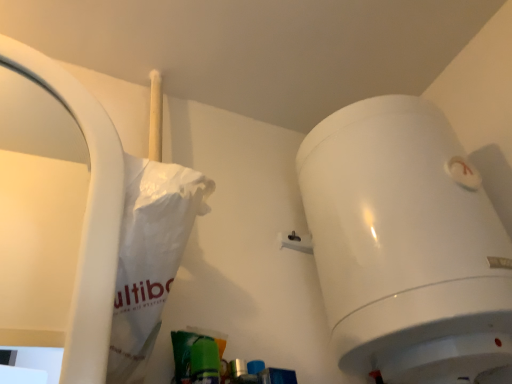
Question: Considering the positions of white glossy toilet at upper right and white paper bag at left in the image, is white glossy toilet at upper right wider or thinner than white paper bag at left?

Choices:
 (A) thin
 (B) wide

Answer: (B)

Question: Which is correct: white glossy toilet at upper right is inside white paper bag at left, or outside of it?

Choices:
 (A) outside
 (B) inside

Answer: (A)

Question: Considering their positions, is white glossy toilet at upper right located in front of or behind white paper bag at left?

Choices:
 (A) front
 (B) behind

Answer: (B)

Question: Does point (129, 314) appear closer or farther from the camera than point (442, 269)?

Choices:
 (A) farther
 (B) closer

Answer: (B)

Question: From the image's perspective, relative to white glossy toilet at upper right, is white paper bag at left above or below?

Choices:
 (A) above
 (B) below

Answer: (A)

Question: Based on their positions, is white paper bag at left located to the left or right of white glossy toilet at upper right?

Choices:
 (A) left
 (B) right

Answer: (A)

Question: From their relative heights in the image, would you say white paper bag at left is taller or shorter than white glossy toilet at upper right?

Choices:
 (A) tall
 (B) short

Answer: (B)